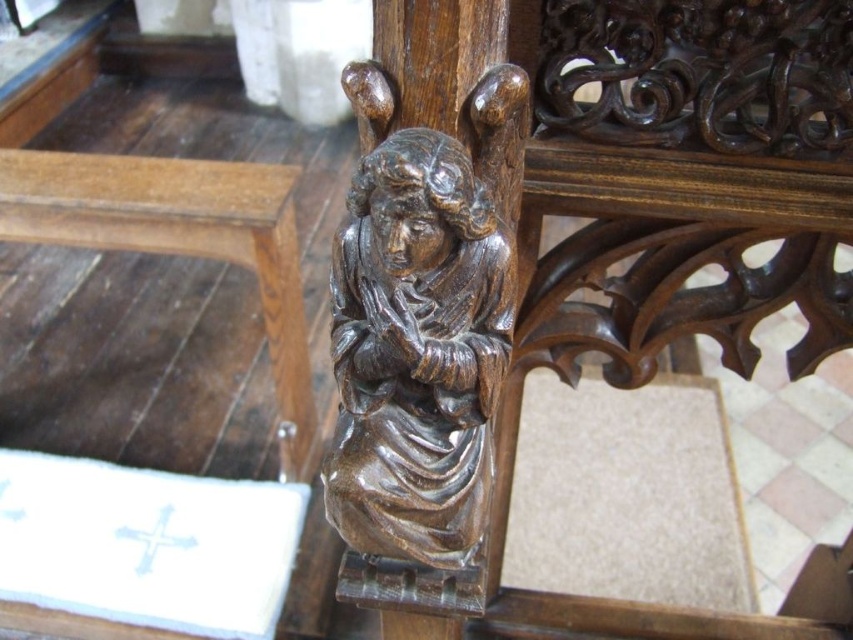
Question: Can you confirm if polished dark wood angel at center is positioned to the left of brown wood table at lower left?

Choices:
 (A) no
 (B) yes

Answer: (A)

Question: Which of the following is the closest to the observer?

Choices:
 (A) polished dark wood angel at center
 (B) brown wood table at lower left

Answer: (A)

Question: Does polished dark wood angel at center appear on the left side of brown wood table at lower left?

Choices:
 (A) yes
 (B) no

Answer: (B)

Question: Which of the following is the farthest from the observer?

Choices:
 (A) brown wood table at lower left
 (B) polished dark wood angel at center

Answer: (A)

Question: Is polished dark wood angel at center further to camera compared to brown wood table at lower left?

Choices:
 (A) no
 (B) yes

Answer: (A)